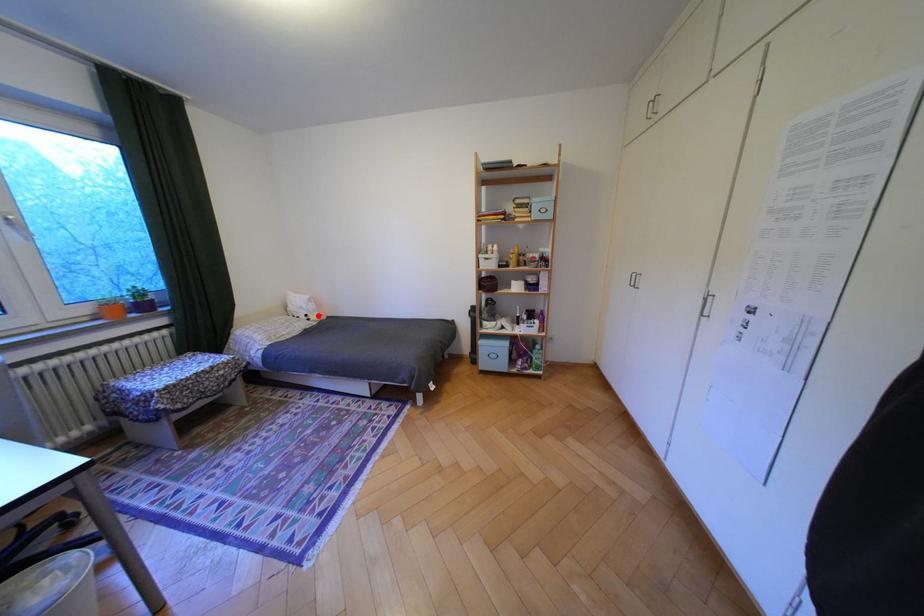
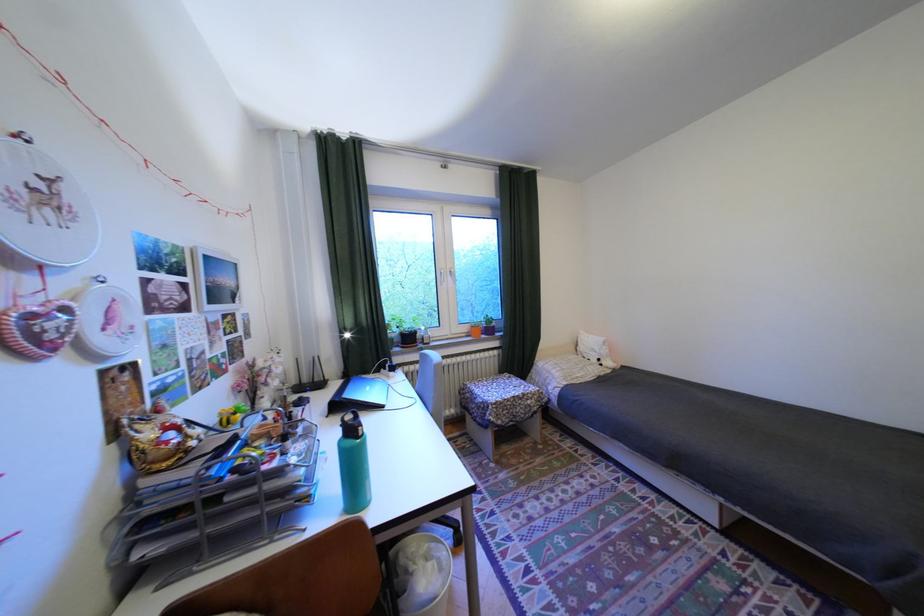
Question: I am providing you with two images of the same scene from different viewpoints. Image1 has a red point marked. In image2, the corresponding 3D location appears at what relative position? Reply with the corresponding letter.

Choices:
 (A) Closer
 (B) Farther

Answer: (B)